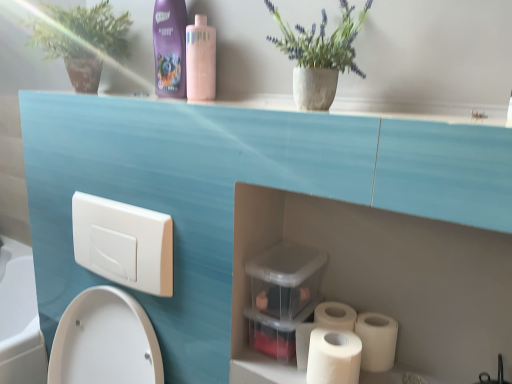
Question: Considering the relative sizes of purple glossy shampoo at upper center, the 1th cleaning product positioned from the left, and matte concrete pot at upper center in the image provided, is purple glossy shampoo at upper center, the 1th cleaning product positioned from the left, smaller than matte concrete pot at upper center?

Choices:
 (A) no
 (B) yes

Answer: (B)

Question: Is purple glossy shampoo at upper center, which is the second cleaning product from right to left, positioned far away from matte concrete pot at upper center?

Choices:
 (A) yes
 (B) no

Answer: (B)

Question: From a real-world perspective, is purple glossy shampoo at upper center, which is the second cleaning product from right to left, physically above matte concrete pot at upper center?

Choices:
 (A) yes
 (B) no

Answer: (A)

Question: Can you confirm if purple glossy shampoo at upper center, which is the second cleaning product from right to left, is thinner than matte concrete pot at upper center?

Choices:
 (A) yes
 (B) no

Answer: (A)

Question: Is purple glossy shampoo at upper center, which is the second cleaning product from right to left, looking in the opposite direction of matte concrete pot at upper center?

Choices:
 (A) yes
 (B) no

Answer: (B)

Question: From the image's perspective, is purple glossy shampoo at upper center, the 1th cleaning product positioned from the left, on matte concrete pot at upper center?

Choices:
 (A) yes
 (B) no

Answer: (A)

Question: Considering the relative positions of white matte toilet paper at lower right, which appears as the 1th toilet paper when viewed from the right, and green matte plant at upper left in the image provided, is white matte toilet paper at lower right, which appears as the 1th toilet paper when viewed from the right, in front of green matte plant at upper left?

Choices:
 (A) no
 (B) yes

Answer: (B)

Question: From the image's perspective, does white matte toilet paper at lower right, marked as the second toilet paper in a left-to-right arrangement, appear higher than green matte plant at upper left?

Choices:
 (A) no
 (B) yes

Answer: (A)

Question: Can you confirm if white matte toilet paper at lower right, marked as the second toilet paper in a left-to-right arrangement, is positioned to the right of green matte plant at upper left?

Choices:
 (A) yes
 (B) no

Answer: (A)

Question: Does white matte toilet paper at lower right, which appears as the 1th toilet paper when viewed from the right, turn towards green matte plant at upper left?

Choices:
 (A) no
 (B) yes

Answer: (A)

Question: Does white matte toilet paper at lower right, which appears as the 1th toilet paper when viewed from the right, have a greater width compared to green matte plant at upper left?

Choices:
 (A) yes
 (B) no

Answer: (B)

Question: Is the depth of white matte toilet paper at lower right, marked as the second toilet paper in a left-to-right arrangement, greater than that of green matte plant at upper left?

Choices:
 (A) no
 (B) yes

Answer: (A)

Question: Does white matte toilet paper at lower right, marked as the second toilet paper in a left-to-right arrangement, appear on the left side of white matte toilet paper at lower right, the second toilet paper positioned from the right?

Choices:
 (A) no
 (B) yes

Answer: (A)